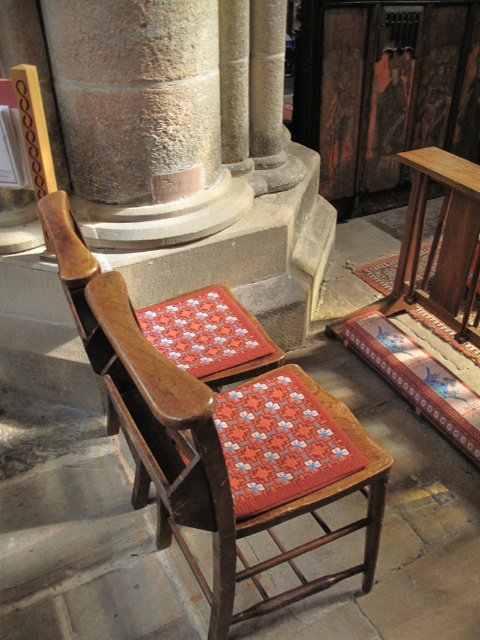
Does point (152, 392) lie behind point (236, 512)?

No, (152, 392) is closer to viewer.

Which is behind, point (196, 410) or point (275, 433)?

Point (275, 433)

Where is `woven fabric cushion at center`? The height and width of the screenshot is (640, 480). woven fabric cushion at center is located at coordinates (215, 460).

Does woven fabric cushion at center come behind knitted woolen cushion at center?

No, woven fabric cushion at center is closer to the viewer.

Does point (242, 520) come farther from viewer compared to point (256, 355)?

No, it is in front of (256, 355).

The image size is (480, 640). Identify the location of woven fabric cushion at center. (215, 460).

Does quilted orange fabric at center appear under knitted woolen cushion at center?

Yes, quilted orange fabric at center is below knitted woolen cushion at center.

Can you confirm if quilted orange fabric at center is thinner than knitted woolen cushion at center?

No, quilted orange fabric at center is not thinner than knitted woolen cushion at center.

Locate an element on the screen. quilted orange fabric at center is located at coordinates (278, 442).

Locate an element on the screen. quilted orange fabric at center is located at coordinates (278, 442).